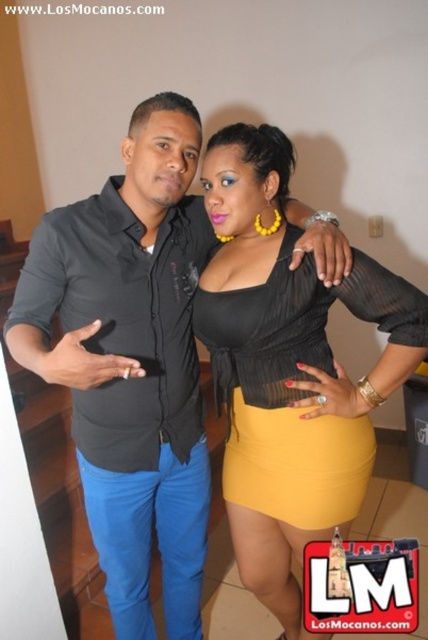
Question: Does black matte shirt at center have a smaller size compared to matte black blouse at center?

Choices:
 (A) no
 (B) yes

Answer: (A)

Question: Does black matte shirt at center have a lesser width compared to matte black blouse at center?

Choices:
 (A) yes
 (B) no

Answer: (A)

Question: Is black matte shirt at center thinner than matte black blouse at center?

Choices:
 (A) yes
 (B) no

Answer: (A)

Question: Which point appears closest to the camera in this image?

Choices:
 (A) (189, 353)
 (B) (291, 456)

Answer: (B)